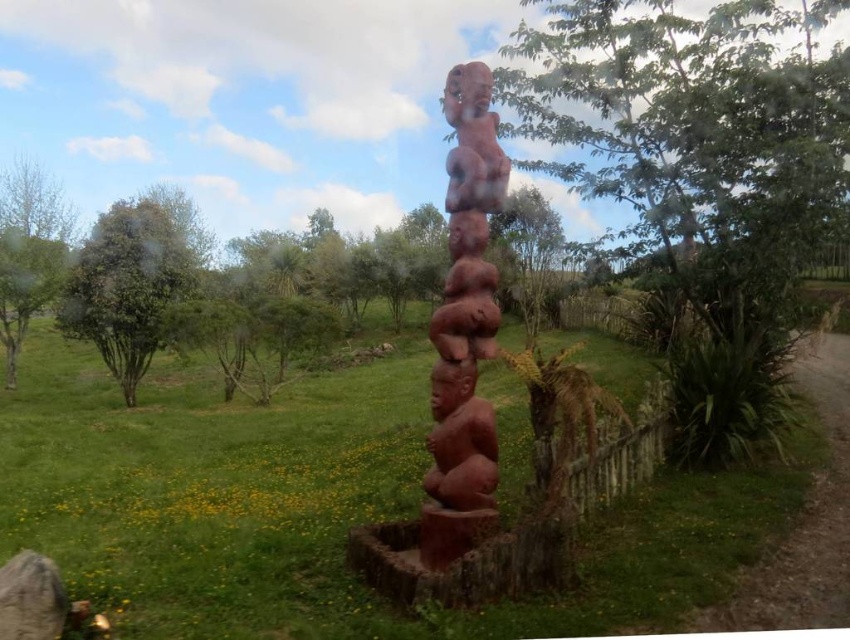
Is green grassy at center positioned at the back of matte reddish-brown totem pole at center?

No, it is not.

Measure the distance between green grassy at center and camera.

They are 2.98 meters apart.

Is point (116, 531) farther from camera compared to point (496, 308)?

Yes, it is.

At what (x,y) coordinates should I click in order to perform the action: click on green grassy at center. Please return your answer as a coordinate pair (x, y). The width and height of the screenshot is (850, 640). Looking at the image, I should click on (316, 506).

Based on the photo, can you confirm if green grassy at center is thinner than green leafy tree at left?

In fact, green grassy at center might be wider than green leafy tree at left.

Between point (593, 602) and point (134, 273), which one is positioned behind?

Positioned behind is point (134, 273).

Is point (491, 618) farther from viewer compared to point (95, 252)?

No, (491, 618) is in front of (95, 252).

The width and height of the screenshot is (850, 640). Find the location of `green grassy at center`. green grassy at center is located at coordinates (316, 506).

Between green grassy at center and green leafy tree at center, which one appears on the left side from the viewer's perspective?

From the viewer's perspective, green grassy at center appears more on the left side.

Is point (635, 548) positioned behind point (786, 64)?

No, (635, 548) is closer to viewer.

This screenshot has width=850, height=640. Find the location of `green grassy at center`. green grassy at center is located at coordinates (316, 506).